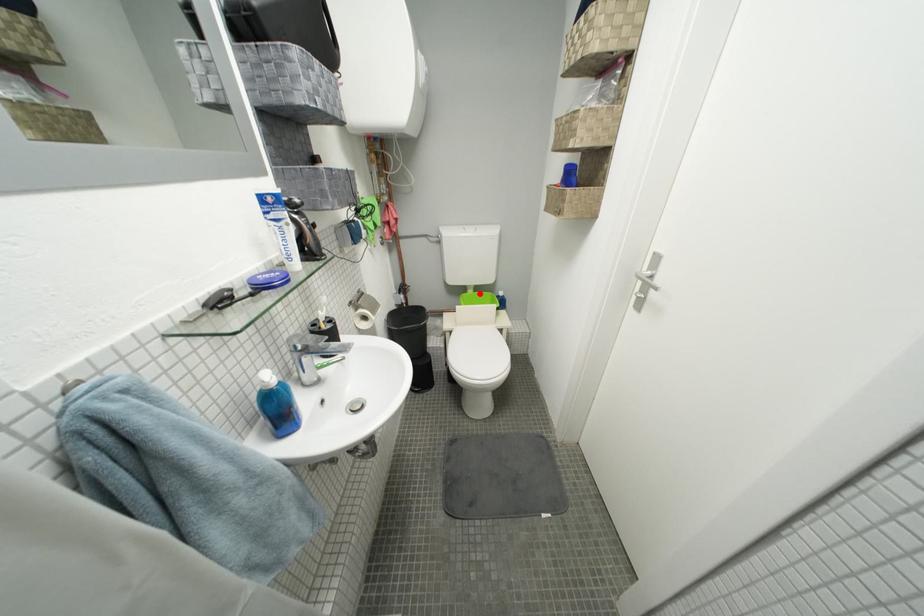
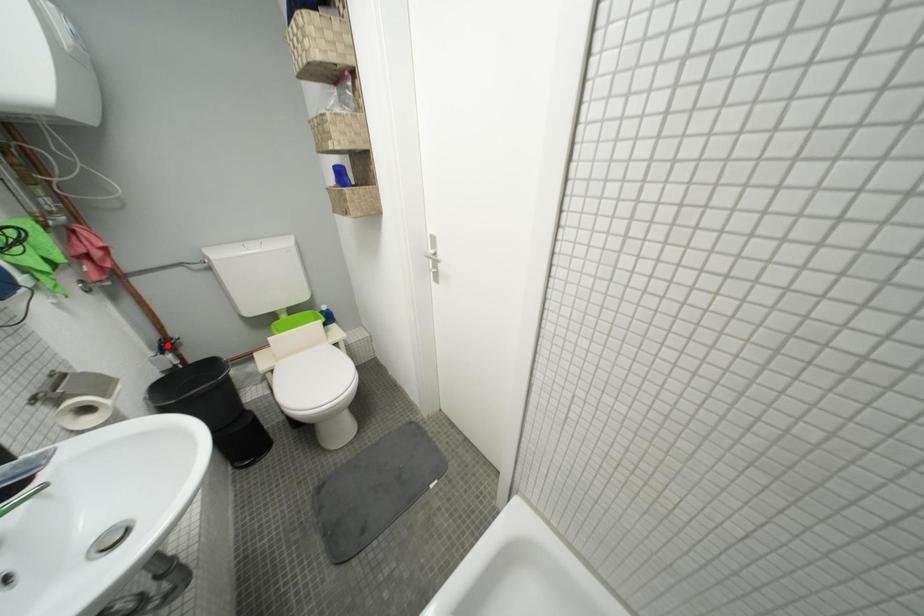
I am providing you with two images of the same scene from different viewpoints. A red point is marked on the first image and another point is marked on the second image. Do the highlighted points in image1 and image2 indicate the same real-world spot?

No